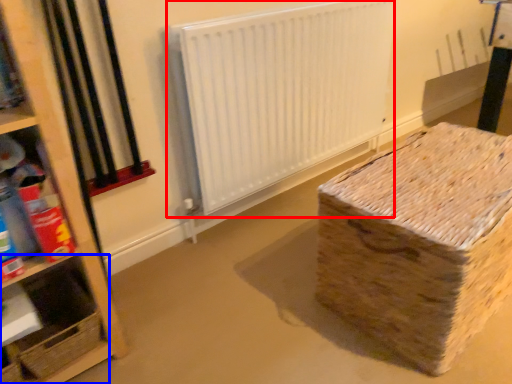
Question: Which of the following is the closest to the observer, radiator (highlighted by a red box) or shelf (highlighted by a blue box)?

Choices:
 (A) radiator
 (B) shelf

Answer: (B)